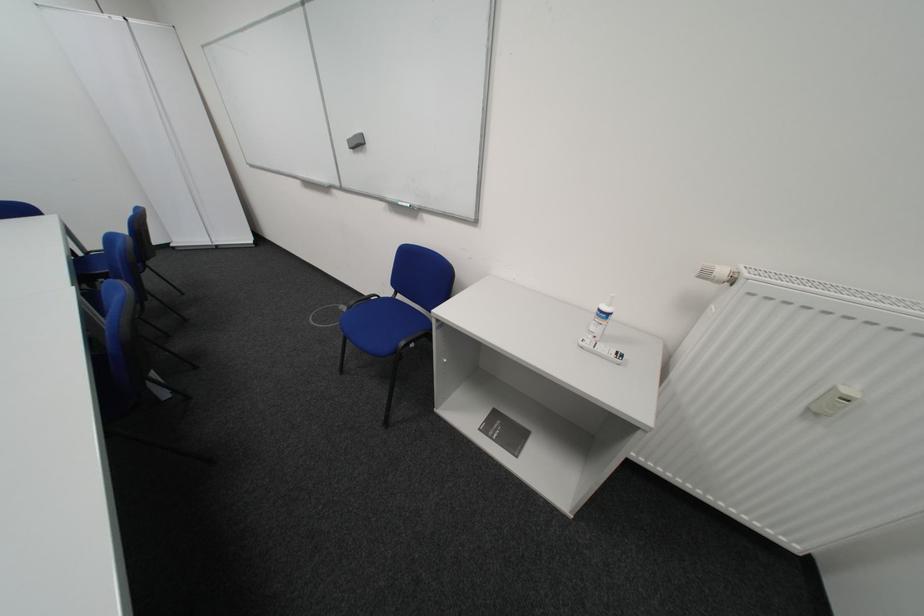
The height and width of the screenshot is (616, 924). What do you see at coordinates (380, 323) in the screenshot?
I see `the blue chair sitting surface` at bounding box center [380, 323].